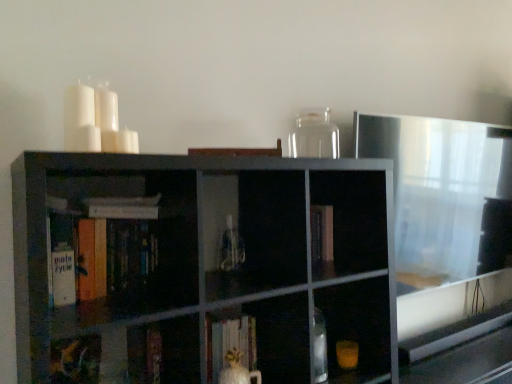
Question: Is white matte candle at upper left, the 2th candle positioned from the right, beside transparent glass jar at upper center?

Choices:
 (A) yes
 (B) no

Answer: (B)

Question: Is white matte candle at upper left, the 2th candle positioned from the right, smaller than transparent glass jar at upper center?

Choices:
 (A) yes
 (B) no

Answer: (A)

Question: Is white matte candle at upper left, which appears as the first candle when viewed from the left, positioned far away from transparent glass jar at upper center?

Choices:
 (A) yes
 (B) no

Answer: (B)

Question: Could you tell me if white matte candle at upper left, which appears as the first candle when viewed from the left, is turned towards transparent glass jar at upper center?

Choices:
 (A) no
 (B) yes

Answer: (A)

Question: Does white matte candle at upper left, the 2th candle positioned from the right, lie in front of transparent glass jar at upper center?

Choices:
 (A) yes
 (B) no

Answer: (A)

Question: Does white matte candle at upper left, which appears as the first candle when viewed from the left, appear on the right side of transparent glass jar at upper center?

Choices:
 (A) no
 (B) yes

Answer: (A)

Question: Is white matte candle at upper left, which ranks as the 2th candle in left-to-right order, far away from white matte book at center, placed as the second book when sorted from bottom to top?

Choices:
 (A) no
 (B) yes

Answer: (A)

Question: Can you confirm if white matte candle at upper left, which ranks as the 2th candle in left-to-right order, is taller than white matte book at center, placed as the second book when sorted from bottom to top?

Choices:
 (A) no
 (B) yes

Answer: (A)

Question: From a real-world perspective, is white matte candle at upper left, the first candle positioned from the right, on white matte book at center, positioned as the fourth book in top-to-bottom order?

Choices:
 (A) yes
 (B) no

Answer: (A)

Question: From a real-world perspective, does white matte candle at upper left, which ranks as the 2th candle in left-to-right order, sit lower than white matte book at center, placed as the second book when sorted from bottom to top?

Choices:
 (A) no
 (B) yes

Answer: (A)

Question: Is white matte candle at upper left, which ranks as the 2th candle in left-to-right order, turned away from white matte book at center, positioned as the fourth book in top-to-bottom order?

Choices:
 (A) no
 (B) yes

Answer: (A)

Question: Would you say white matte book at center, positioned as the fourth book in top-to-bottom order, is part of white matte candle at upper left, the first candle positioned from the right,'s contents?

Choices:
 (A) no
 (B) yes

Answer: (A)

Question: Would you say matte green book at lower left, the fifth book from the top, is part of hardcover book at center, which is counted as the 5th book, starting from the bottom,'s contents?

Choices:
 (A) yes
 (B) no

Answer: (B)